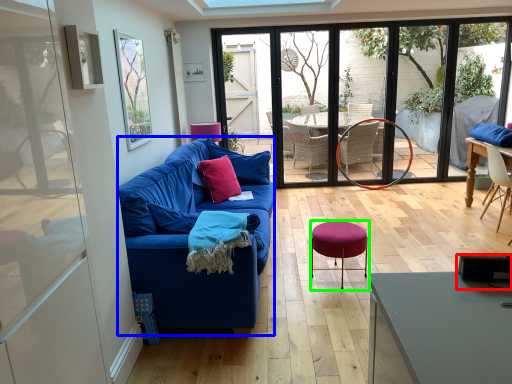
Question: Which is nearer to the loudspeaker (highlighted by a red box)? studio couch (highlighted by a blue box) or bar stool (highlighted by a green box).

Choices:
 (A) studio couch
 (B) bar stool

Answer: (B)